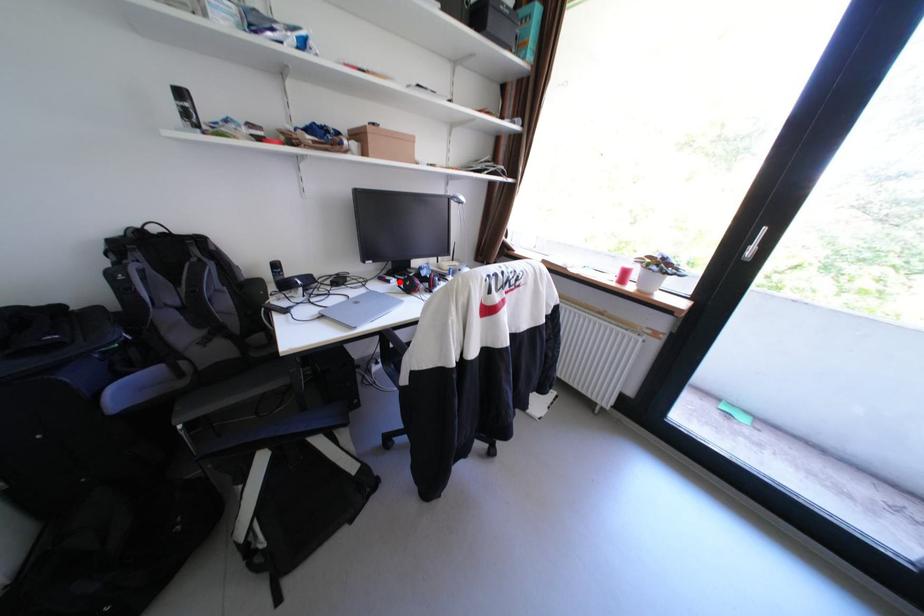
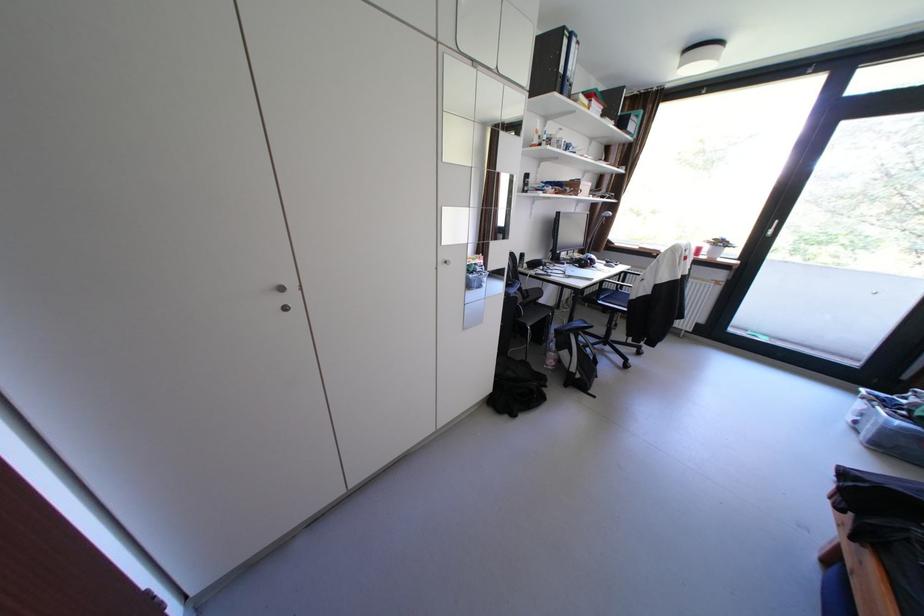
Locate, in the second image, the point that corresponds to the highlighted location in the first image.

(574, 264)